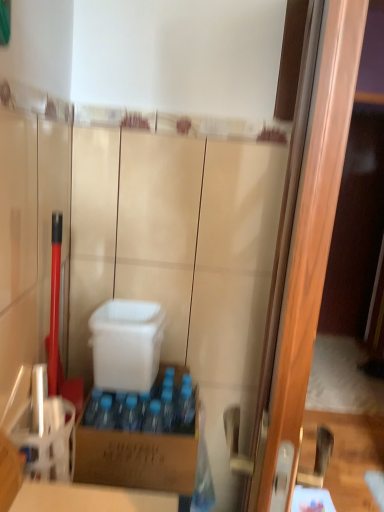
How much space does brown cardboard box at center, placed as the 1th box when sorted from bottom to top, occupy horizontally?

brown cardboard box at center, placed as the 1th box when sorted from bottom to top, is 12.44 inches wide.

Where is `brown cardboard box at center, the second box when ordered from top to bottom`? This screenshot has height=512, width=384. brown cardboard box at center, the second box when ordered from top to bottom is located at coordinates (137, 456).

Which object is wider, wooden screen door at right or white plastic container at center, which ranks as the 2th box in bottom-to-top order?

Wider between the two is white plastic container at center, which ranks as the 2th box in bottom-to-top order.

In the image, is wooden screen door at right positioned in front of or behind white plastic container at center, which ranks as the 2th box in bottom-to-top order?

wooden screen door at right is in front of white plastic container at center, which ranks as the 2th box in bottom-to-top order.

Between wooden screen door at right and white plastic container at center, which is counted as the 1th box, starting from the top, which one has larger size?

With larger size is wooden screen door at right.

Does wooden screen door at right have a greater height compared to white plastic container at center, which ranks as the 2th box in bottom-to-top order?

Yes, wooden screen door at right is taller than white plastic container at center, which ranks as the 2th box in bottom-to-top order.

Is wooden screen door at right shorter than brown cardboard box at center, the second box when ordered from top to bottom?

No.

Which object is closer to the camera taking this photo, wooden screen door at right or brown cardboard box at center, placed as the 1th box when sorted from bottom to top?

wooden screen door at right is in front.

From the picture: Would you say wooden screen door at right is a long distance from brown cardboard box at center, the second box when ordered from top to bottom?

wooden screen door at right is actually quite close to brown cardboard box at center, the second box when ordered from top to bottom.

Can you confirm if wooden screen door at right is positioned to the right of brown cardboard box at center, the second box when ordered from top to bottom?

Indeed, wooden screen door at right is positioned on the right side of brown cardboard box at center, the second box when ordered from top to bottom.

Considering the sizes of white plastic container at center, which is counted as the 1th box, starting from the top, and brown cardboard box at center, placed as the 1th box when sorted from bottom to top, in the image, is white plastic container at center, which is counted as the 1th box, starting from the top, bigger or smaller than brown cardboard box at center, placed as the 1th box when sorted from bottom to top,?

Considering their sizes, white plastic container at center, which is counted as the 1th box, starting from the top, takes up less space than brown cardboard box at center, placed as the 1th box when sorted from bottom to top.

Where is `box on the right of the white plastic container at center, which is counted as the 1th box, starting from the top`? The width and height of the screenshot is (384, 512). box on the right of the white plastic container at center, which is counted as the 1th box, starting from the top is located at coordinates (137, 456).

Would you consider white plastic container at center, which is counted as the 1th box, starting from the top, to be distant from brown cardboard box at center, the second box when ordered from top to bottom?

No, white plastic container at center, which is counted as the 1th box, starting from the top, is not far away from brown cardboard box at center, the second box when ordered from top to bottom.

From a real-world perspective, is white plastic container at center, which is counted as the 1th box, starting from the top, beneath brown cardboard box at center, placed as the 1th box when sorted from bottom to top?

No.

Considering the positions of points (182, 494) and (262, 483), is point (182, 494) closer to camera compared to point (262, 483)?

No, (182, 494) is further to viewer.

Considering the relative positions of brown cardboard box at center, placed as the 1th box when sorted from bottom to top, and wooden screen door at right in the image provided, is brown cardboard box at center, placed as the 1th box when sorted from bottom to top, to the left of wooden screen door at right from the viewer's perspective?

Yes, brown cardboard box at center, placed as the 1th box when sorted from bottom to top, is to the left of wooden screen door at right.

From a real-world perspective, which object rests below the other?

From a 3D spatial view, brown cardboard box at center, the second box when ordered from top to bottom, is below.

Is point (144, 317) closer to viewer compared to point (296, 329)?

That is False.

Is white plastic container at center, which ranks as the 2th box in bottom-to-top order, looking in the opposite direction of wooden screen door at right?

That's not correct — white plastic container at center, which ranks as the 2th box in bottom-to-top order, is not looking away from wooden screen door at right.

Is white plastic container at center, which is counted as the 1th box, starting from the top, outside of wooden screen door at right?

That's correct, white plastic container at center, which is counted as the 1th box, starting from the top, is outside of wooden screen door at right.

Identify the location of the 1st box positioned below the wooden screen door at right (from the image's perspective). Image resolution: width=384 pixels, height=512 pixels. (126, 344).

From a real-world perspective, is brown cardboard box at center, placed as the 1th box when sorted from bottom to top, above or below white plastic container at center, which ranks as the 2th box in bottom-to-top order?

brown cardboard box at center, placed as the 1th box when sorted from bottom to top, is below white plastic container at center, which ranks as the 2th box in bottom-to-top order.

Is the position of brown cardboard box at center, placed as the 1th box when sorted from bottom to top, more distant than that of white plastic container at center, which ranks as the 2th box in bottom-to-top order?

No, it is in front of white plastic container at center, which ranks as the 2th box in bottom-to-top order.

From the image's perspective, between brown cardboard box at center, the second box when ordered from top to bottom, and white plastic container at center, which ranks as the 2th box in bottom-to-top order, who is located below?

brown cardboard box at center, the second box when ordered from top to bottom, appears lower in the image.

Considering the sizes of brown cardboard box at center, the second box when ordered from top to bottom, and white plastic container at center, which ranks as the 2th box in bottom-to-top order, in the image, is brown cardboard box at center, the second box when ordered from top to bottom, bigger or smaller than white plastic container at center, which ranks as the 2th box in bottom-to-top order,?

In the image, brown cardboard box at center, the second box when ordered from top to bottom, appears to be larger than white plastic container at center, which ranks as the 2th box in bottom-to-top order.

Find the location of `screen door above the white plastic container at center, which ranks as the 2th box in bottom-to-top order (from a real-world perspective)`. screen door above the white plastic container at center, which ranks as the 2th box in bottom-to-top order (from a real-world perspective) is located at coordinates (312, 234).

This screenshot has height=512, width=384. Find the location of `the 1st box counting from the left of the wooden screen door at right`. the 1st box counting from the left of the wooden screen door at right is located at coordinates (137, 456).

In the scene shown: Considering their positions, is wooden screen door at right positioned closer to brown cardboard box at center, placed as the 1th box when sorted from bottom to top, than white plastic container at center, which is counted as the 1th box, starting from the top?

white plastic container at center, which is counted as the 1th box, starting from the top, is positioned closer to the anchor brown cardboard box at center, placed as the 1th box when sorted from bottom to top.

When comparing their distances from brown cardboard box at center, the second box when ordered from top to bottom, does white plastic container at center, which ranks as the 2th box in bottom-to-top order, or wooden screen door at right seem further?

wooden screen door at right lies further to brown cardboard box at center, the second box when ordered from top to bottom, than the other object.

Looking at the image, which one is located closer to wooden screen door at right, brown cardboard box at center, the second box when ordered from top to bottom, or white plastic container at center, which ranks as the 2th box in bottom-to-top order?

Among the two, brown cardboard box at center, the second box when ordered from top to bottom, is located nearer to wooden screen door at right.

When comparing their distances from wooden screen door at right, does white plastic container at center, which ranks as the 2th box in bottom-to-top order, or brown cardboard box at center, the second box when ordered from top to bottom, seem further?

Based on the image, white plastic container at center, which ranks as the 2th box in bottom-to-top order, appears to be further to wooden screen door at right.

From the image, which object appears to be nearer to white plastic container at center, which ranks as the 2th box in bottom-to-top order, wooden screen door at right or brown cardboard box at center, the second box when ordered from top to bottom?

Among the two, brown cardboard box at center, the second box when ordered from top to bottom, is located nearer to white plastic container at center, which ranks as the 2th box in bottom-to-top order.

Which object lies further to the anchor point white plastic container at center, which ranks as the 2th box in bottom-to-top order, brown cardboard box at center, placed as the 1th box when sorted from bottom to top, or wooden screen door at right?

Based on the image, wooden screen door at right appears to be further to white plastic container at center, which ranks as the 2th box in bottom-to-top order.

I want to click on box between wooden screen door at right and white plastic container at center, which is counted as the 1th box, starting from the top, from front to back, so click(x=137, y=456).